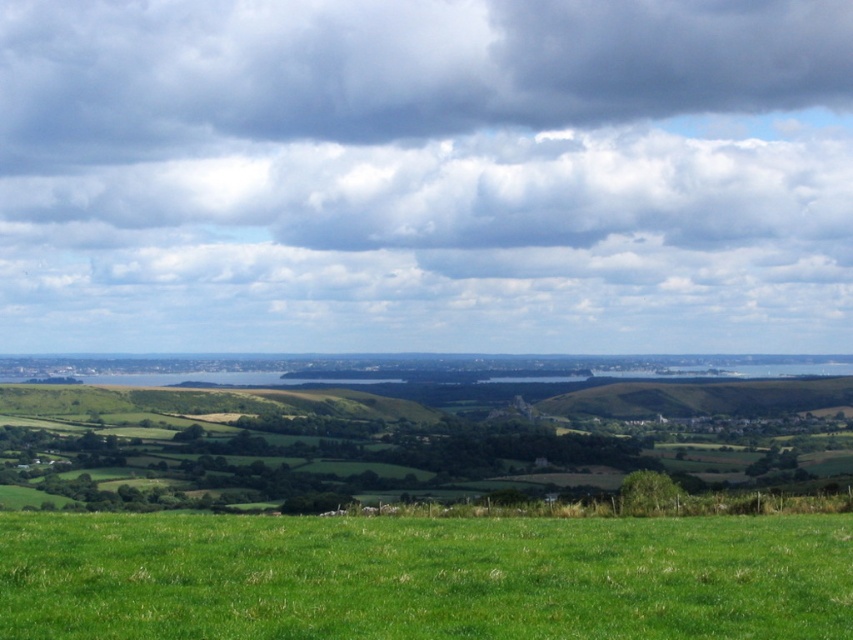
You are standing in the rural landscape and want to walk from point A to point B. Point A is located at coordinate point [16,8] and point B is at coordinate point [334,83]. Which point is closer to you when you start walking?

Point A at coordinate point [16,8] is closer to you because it is further to the viewer than point B at coordinate point [334,83], so you will reach it first.

You are standing at the center of the image and want to walk to the green grassy field at lower center. In which direction should you move?

Since the green grassy field at lower center is located at point [422,577], which is to the right and slightly below the center of the image, you should move towards the lower right direction to reach it.

You are an airplane pilot preparing for takeoff. You notice the cloudy sky at upper center and the dark gray cloud at upper center in the distance. According to the scene, which of these two objects is closer to your current position?

The cloudy sky at upper center is closer to your current position because it is in front of the dark gray cloud at upper center.